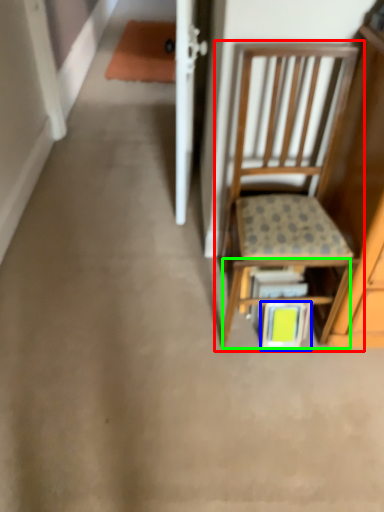
Question: Estimate the real-world distances between objects in this image. Which object is closer to chair (highlighted by a red box), book (highlighted by a blue box) or shelf (highlighted by a green box)?

Choices:
 (A) book
 (B) shelf

Answer: (B)